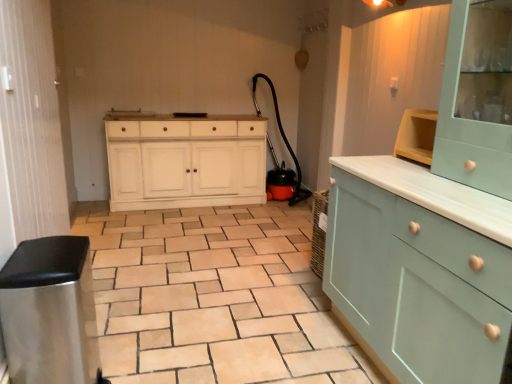
Question: In which direction should I rotate to look at light blue wood cabinet at center, the second cabinetry when ordered from top to bottom?

Choices:
 (A) right
 (B) left

Answer: (A)

Question: From the image's perspective, is light teal wood cabinet at upper right, arranged as the 2th cabinetry when ordered from the bottom, above light blue wood cabinet at center, the second cabinetry when ordered from top to bottom?

Choices:
 (A) yes
 (B) no

Answer: (A)

Question: Considering the relative positions of light teal wood cabinet at upper right, which is counted as the first cabinetry, starting from the top, and light blue wood cabinet at center, placed as the first cabinetry when sorted from bottom to top, in the image provided, is light teal wood cabinet at upper right, which is counted as the first cabinetry, starting from the top, to the right of light blue wood cabinet at center, placed as the first cabinetry when sorted from bottom to top, from the viewer's perspective?

Choices:
 (A) yes
 (B) no

Answer: (A)

Question: Can you confirm if light teal wood cabinet at upper right, arranged as the 2th cabinetry when ordered from the bottom, is taller than light blue wood cabinet at center, placed as the first cabinetry when sorted from bottom to top?

Choices:
 (A) yes
 (B) no

Answer: (B)

Question: Is light teal wood cabinet at upper right, which is counted as the first cabinetry, starting from the top, closer to camera compared to light blue wood cabinet at center, placed as the first cabinetry when sorted from bottom to top?

Choices:
 (A) no
 (B) yes

Answer: (A)

Question: Is light teal wood cabinet at upper right, which is counted as the first cabinetry, starting from the top, far away from light blue wood cabinet at center, placed as the first cabinetry when sorted from bottom to top?

Choices:
 (A) yes
 (B) no

Answer: (B)

Question: Would you say light blue wood cabinet at center, the second cabinetry when ordered from top to bottom, is part of light teal wood cabinet at upper right, arranged as the 2th cabinetry when ordered from the bottom,'s contents?

Choices:
 (A) no
 (B) yes

Answer: (A)

Question: Can you confirm if light teal wood cabinet at upper right, which is counted as the first cabinetry, starting from the top, is taller than beige ceramic tile at center?

Choices:
 (A) no
 (B) yes

Answer: (B)

Question: Considering the relative sizes of light teal wood cabinet at upper right, which is counted as the first cabinetry, starting from the top, and beige ceramic tile at center in the image provided, is light teal wood cabinet at upper right, which is counted as the first cabinetry, starting from the top, wider than beige ceramic tile at center?

Choices:
 (A) yes
 (B) no

Answer: (B)

Question: From the image's perspective, is light teal wood cabinet at upper right, which is counted as the first cabinetry, starting from the top, above beige ceramic tile at center?

Choices:
 (A) yes
 (B) no

Answer: (A)

Question: Is light teal wood cabinet at upper right, arranged as the 2th cabinetry when ordered from the bottom, positioned before beige ceramic tile at center?

Choices:
 (A) no
 (B) yes

Answer: (B)

Question: Is light teal wood cabinet at upper right, which is counted as the first cabinetry, starting from the top, further to the viewer compared to beige ceramic tile at center?

Choices:
 (A) no
 (B) yes

Answer: (A)

Question: Is light blue wood cabinet at center, the second cabinetry when ordered from top to bottom, at the right side of white painted wood cabinet at center?

Choices:
 (A) yes
 (B) no

Answer: (A)